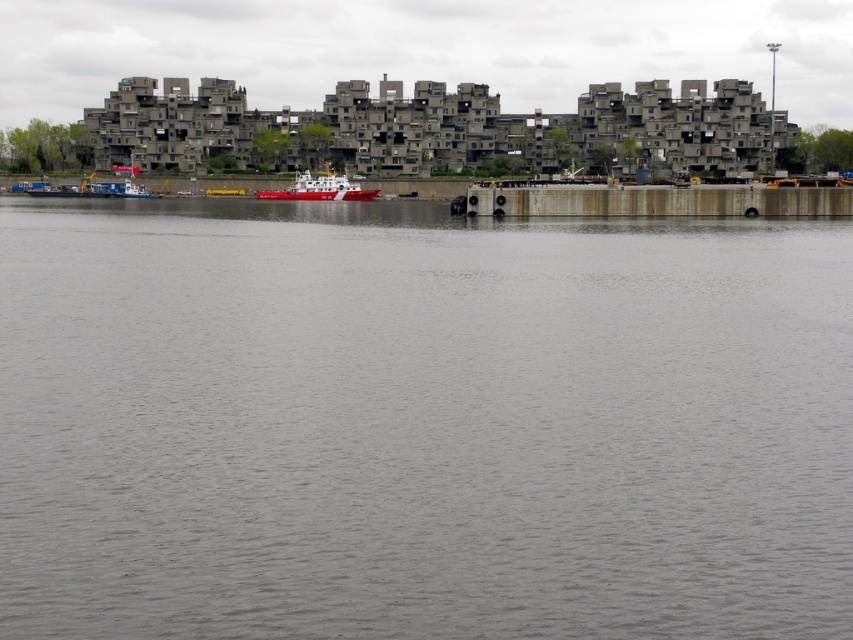
Measure the distance between gray water at center and red glossy boat at center.

gray water at center and red glossy boat at center are 66.70 meters apart.

Is point (601, 502) positioned behind point (294, 177)?

No, (601, 502) is in front of (294, 177).

Who is more forward, (585, 582) or (370, 196)?

Point (585, 582)

Find the location of a particular element. gray water at center is located at coordinates (421, 422).